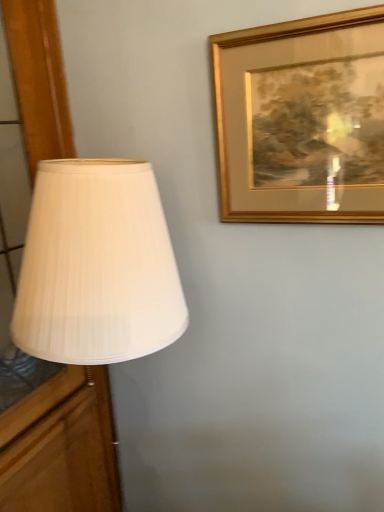
What is the approximate height of gold/golden frame at upper right?

gold/golden frame at upper right is 14.98 inches tall.

What do you see at coordinates (301, 120) in the screenshot? The image size is (384, 512). I see `gold/golden frame at upper right` at bounding box center [301, 120].

The height and width of the screenshot is (512, 384). Find the location of `gold/golden frame at upper right`. gold/golden frame at upper right is located at coordinates (301, 120).

Locate an element on the screen. The width and height of the screenshot is (384, 512). gold/golden frame at upper right is located at coordinates (301, 120).